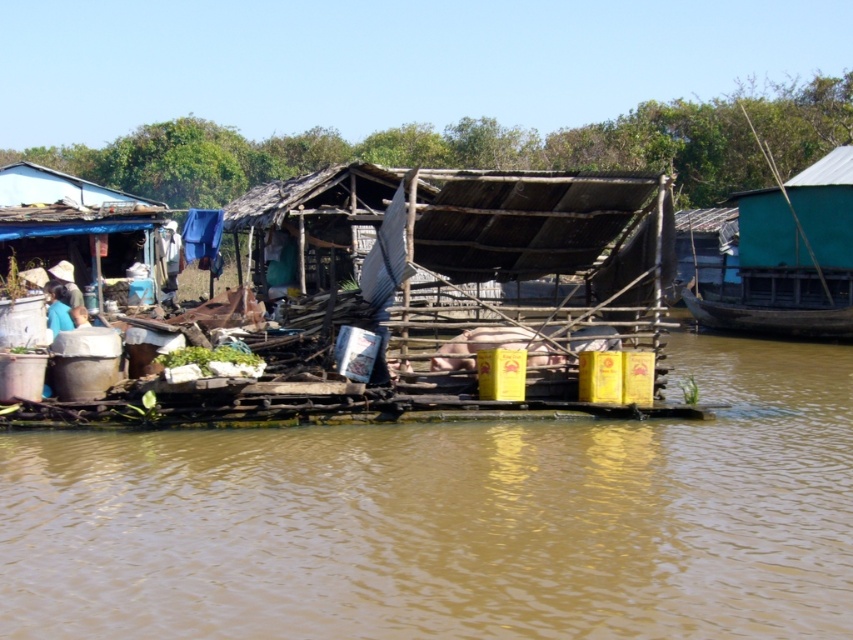
Question: Which point appears closest to the camera in this image?

Choices:
 (A) (108, 612)
 (B) (90, 257)

Answer: (A)

Question: Does rusty corrugated metal hut at left have a larger size compared to blue fabric at left?

Choices:
 (A) yes
 (B) no

Answer: (A)

Question: Which object appears closest to the camera in this image?

Choices:
 (A) brown muddy water at center
 (B) green corrugated metal boat at right
 (C) rusty corrugated metal hut at left
 (D) blue fabric at left

Answer: (A)

Question: Can you confirm if rusty corrugated metal hut at left is positioned to the right of blue fabric at left?

Choices:
 (A) yes
 (B) no

Answer: (B)

Question: Can you confirm if brown muddy water at center is positioned below rusty corrugated metal hut at left?

Choices:
 (A) no
 (B) yes

Answer: (B)

Question: Considering the real-world distances, which object is farthest from the blue fabric at left?

Choices:
 (A) brown muddy water at center
 (B) green corrugated metal boat at right
 (C) rusty corrugated metal hut at left

Answer: (B)